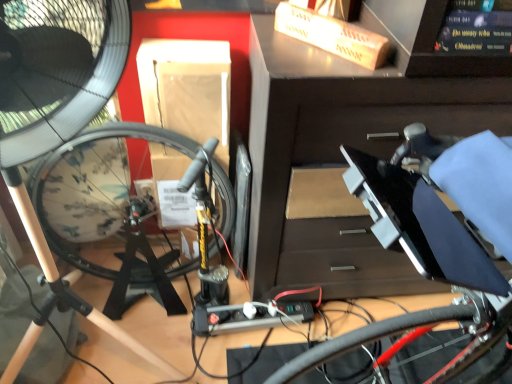
I want to click on black plastic workbench at center, so pos(341,157).

Identify the location of black glossy book at upper right. The height and width of the screenshot is (384, 512). (448, 53).

Find the location of a particular element. The height and width of the screenshot is (384, 512). black plastic workbench at center is located at coordinates (341, 157).

Could you tell me if black glossy book at upper right is turned towards black matte fan at left?

No, black glossy book at upper right does not turn towards black matte fan at left.

Identify the location of computer screen in front of the black matte fan at left. The width and height of the screenshot is (512, 384). (448, 53).

Considering the relative sizes of black glossy book at upper right and black matte fan at left in the image provided, is black glossy book at upper right bigger than black matte fan at left?

No, black glossy book at upper right is not bigger than black matte fan at left.

In terms of height, does black glossy book at upper right look taller or shorter compared to black matte fan at left?

In the image, black glossy book at upper right appears to be shorter than black matte fan at left.

How far apart are shiny red bicycle wheel at lower right and black glossy book at upper right?

The distance of shiny red bicycle wheel at lower right from black glossy book at upper right is 22.94 inches.

Which object is positioned more to the left, shiny red bicycle wheel at lower right or black glossy book at upper right?

shiny red bicycle wheel at lower right is more to the left.

Between shiny red bicycle wheel at lower right and black glossy book at upper right, which one has smaller size?

black glossy book at upper right.

Based on the photo, from a real-world perspective, is shiny red bicycle wheel at lower right on black glossy book at upper right?

No, from a real-world perspective, shiny red bicycle wheel at lower right is not on top of black glossy book at upper right.

In the scene shown: Is black matte fan at left turned away from shiny red bicycle wheel at lower right?

No, shiny red bicycle wheel at lower right is not at the back of black matte fan at left.

Which point is more distant from viewer, [62,118] or [397,321]?

The point [62,118] is behind.

The image size is (512, 384). What are the coordinates of `mechanical fan above the shiny red bicycle wheel at lower right (from the image's perspective)` in the screenshot? It's located at (57, 69).

Does black matte fan at left appear on the left side of shiny red bicycle wheel at lower right?

Yes.

Is black glossy book at upper right bigger or smaller than shiny red bicycle wheel at lower right?

In the image, black glossy book at upper right appears to be smaller than shiny red bicycle wheel at lower right.

Is shiny red bicycle wheel at lower right inside black glossy book at upper right?

No, shiny red bicycle wheel at lower right is not inside black glossy book at upper right.

Is black glossy book at upper right facing towards shiny red bicycle wheel at lower right?

No, black glossy book at upper right is not aimed at shiny red bicycle wheel at lower right.

Is black glossy book at upper right in front of shiny red bicycle wheel at lower right?

Yes, it is.

Looking at this image, does black matte fan at left have a greater width compared to black plastic workbench at center?

Incorrect, the width of black matte fan at left does not surpass that of black plastic workbench at center.

Is black matte fan at left taller than black plastic workbench at center?

No.

Is black matte fan at left positioned beyond the bounds of black plastic workbench at center?

black matte fan at left is positioned outside black plastic workbench at center.

Considering the relative sizes of black matte fan at left and black plastic workbench at center in the image provided, is black matte fan at left smaller than black plastic workbench at center?

Indeed, black matte fan at left has a smaller size compared to black plastic workbench at center.

Looking at this image, from a real-world perspective, which is physically below, shiny red bicycle wheel at lower right or black plastic workbench at center?

shiny red bicycle wheel at lower right.

Are shiny red bicycle wheel at lower right and black plastic workbench at center far apart?

Actually, shiny red bicycle wheel at lower right and black plastic workbench at center are a little close together.

Can you confirm if shiny red bicycle wheel at lower right is taller than black plastic workbench at center?

No, shiny red bicycle wheel at lower right is not taller than black plastic workbench at center.

Is point (334, 346) behind point (436, 100)?

No.

Between black plastic workbench at center and black matte fan at left, which one has smaller width?

With smaller width is black matte fan at left.

Does black plastic workbench at center have a greater height compared to black matte fan at left?

Yes.

Considering the relative sizes of black plastic workbench at center and black matte fan at left in the image provided, is black plastic workbench at center smaller than black matte fan at left?

Incorrect, black plastic workbench at center is not smaller in size than black matte fan at left.

The width and height of the screenshot is (512, 384). Identify the location of mechanical fan to the left of black plastic workbench at center. (57, 69).

You are a GUI agent. You are given a task and a screenshot of the screen. Output one action in this format:
    pyautogui.click(x=<x>, y=<y>)
    Task: Click on the computer screen lying on the right of black matte fan at left
    This screenshot has width=512, height=384.
    Given the screenshot: What is the action you would take?
    pyautogui.click(x=448, y=53)

Identify the location of computer screen that is above the shiny red bicycle wheel at lower right (from the image's perspective). (448, 53).

When comparing their distances from black glossy book at upper right, does black plastic workbench at center or shiny red bicycle wheel at lower right seem further?

The object further to black glossy book at upper right is shiny red bicycle wheel at lower right.

From the image, which object appears to be farther from shiny red bicycle wheel at lower right, black plastic workbench at center or black matte fan at left?

black matte fan at left.

From the image, which object appears to be farther from black plastic workbench at center, black glossy book at upper right or black matte fan at left?

black matte fan at left is further to black plastic workbench at center.

Which object lies further to the anchor point black matte fan at left, black glossy book at upper right or shiny red bicycle wheel at lower right?

shiny red bicycle wheel at lower right.

Considering their positions, is shiny red bicycle wheel at lower right positioned further to black glossy book at upper right than black plastic workbench at center?

Based on the image, shiny red bicycle wheel at lower right appears to be further to black glossy book at upper right.

Which object lies further to the anchor point black plastic workbench at center, black glossy book at upper right or shiny red bicycle wheel at lower right?

shiny red bicycle wheel at lower right.

Which object lies nearer to the anchor point shiny red bicycle wheel at lower right, black glossy book at upper right or black matte fan at left?

Among the two, black glossy book at upper right is located nearer to shiny red bicycle wheel at lower right.

Based on the photo, from the image, which object appears to be farther from black plastic workbench at center, shiny red bicycle wheel at lower right or black glossy book at upper right?

shiny red bicycle wheel at lower right lies further to black plastic workbench at center than the other object.

What are the coordinates of `bicycle wheel between black matte fan at left and black plastic workbench at center` in the screenshot? It's located at (368, 338).

The height and width of the screenshot is (384, 512). I want to click on computer screen between black matte fan at left and black plastic workbench at center in the horizontal direction, so click(x=448, y=53).

The image size is (512, 384). In order to click on workbench that lies between black glossy book at upper right and shiny red bicycle wheel at lower right from top to bottom in this screenshot , I will do `click(341, 157)`.

The width and height of the screenshot is (512, 384). Find the location of `bicycle wheel situated between black matte fan at left and black glossy book at upper right from left to right`. bicycle wheel situated between black matte fan at left and black glossy book at upper right from left to right is located at coordinates (368, 338).